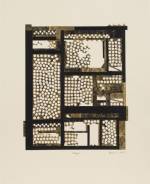
Image resolution: width=150 pixels, height=184 pixels. In order to click on hallway rendition in this screenshot , I will do `click(88, 114)`, `click(86, 34)`.